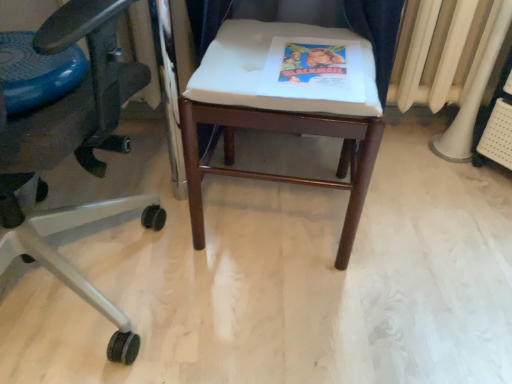
Locate an element on the screen. This screenshot has width=512, height=384. free area in between white fabric stool at center and white plastic radiator at right is located at coordinates (398, 189).